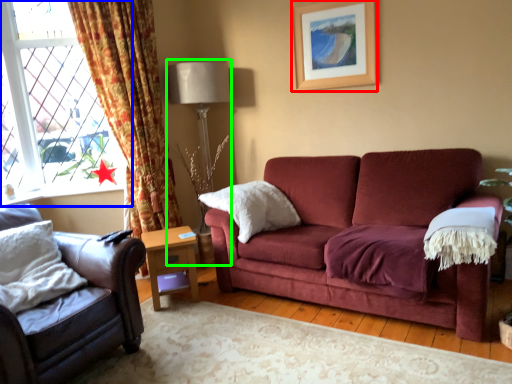
Question: Estimate the real-world distances between objects in this image. Which object is closer to picture frame (highlighted by a red box), window (highlighted by a blue box) or table lamp (highlighted by a green box)?

Choices:
 (A) window
 (B) table lamp

Answer: (B)